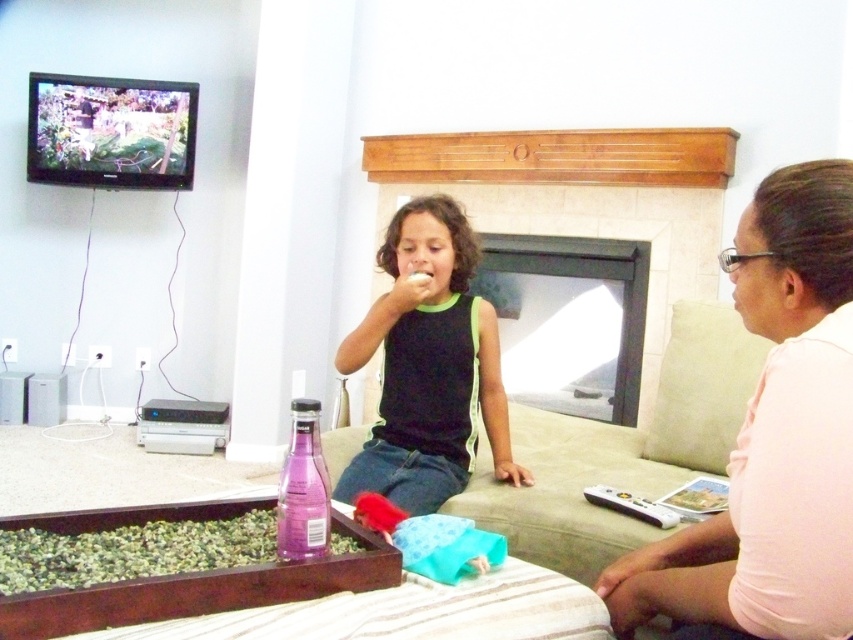
You are sitting on the sofa in the living room and want to reach both the point at (637,193) and the point at (575,424). Which point is closer to you?

The point at (637,193) is closer to you because it is further to the viewer than the point at (575,424).

You are a delivery robot that is 60 centimeters wide. You need to move from the entrance to the sofa where the black matte tank top at center and purple glass bottle at lower center are located. Can you fit through the space between the sofa and the coffee table?

The distance between the black matte tank top at center and purple glass bottle at lower center is 74.03 centimeters. Since the robot is 60 centimeters wide, it can fit through the space as the available width is greater than the robot.